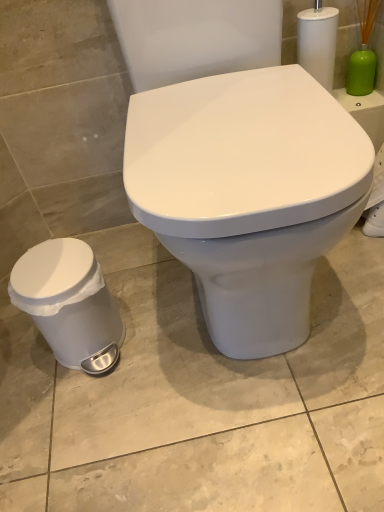
Question: Is white glossy toilet at center surrounded by white plastic trash can at lower left?

Choices:
 (A) no
 (B) yes

Answer: (A)

Question: Is white plastic trash can at lower left smaller than white glossy toilet at center?

Choices:
 (A) yes
 (B) no

Answer: (A)

Question: Does white plastic trash can at lower left appear on the right side of white glossy toilet at center?

Choices:
 (A) yes
 (B) no

Answer: (B)

Question: Is white plastic trash can at lower left not near white glossy toilet at center?

Choices:
 (A) yes
 (B) no

Answer: (B)

Question: Considering the relative sizes of white plastic trash can at lower left and white glossy toilet at center in the image provided, is white plastic trash can at lower left thinner than white glossy toilet at center?

Choices:
 (A) yes
 (B) no

Answer: (A)

Question: Based on their sizes in the image, would you say green matte brush at upper right is bigger or smaller than white glossy toilet at center?

Choices:
 (A) big
 (B) small

Answer: (B)

Question: Is green matte brush at upper right taller or shorter than white glossy toilet at center?

Choices:
 (A) short
 (B) tall

Answer: (A)

Question: From a real-world perspective, is green matte brush at upper right above or below white glossy toilet at center?

Choices:
 (A) below
 (B) above

Answer: (B)

Question: Is green matte brush at upper right wider or thinner than white glossy toilet at center?

Choices:
 (A) thin
 (B) wide

Answer: (A)

Question: In the image, is white glossy toilet at center positioned in front of or behind green matte brush at upper right?

Choices:
 (A) behind
 (B) front

Answer: (B)

Question: From the image's perspective, is white glossy toilet at center positioned above or below green matte brush at upper right?

Choices:
 (A) below
 (B) above

Answer: (A)

Question: Does point (201, 169) appear closer or farther from the camera than point (374, 10)?

Choices:
 (A) farther
 (B) closer

Answer: (B)

Question: From their relative heights in the image, would you say white glossy toilet at center is taller or shorter than green matte brush at upper right?

Choices:
 (A) short
 (B) tall

Answer: (B)

Question: From the image's perspective, is white plastic trash can at lower left located above or below white glossy toilet at center?

Choices:
 (A) above
 (B) below

Answer: (B)

Question: Choose the correct answer: Is white plastic trash can at lower left inside white glossy toilet at center or outside it?

Choices:
 (A) outside
 (B) inside

Answer: (A)